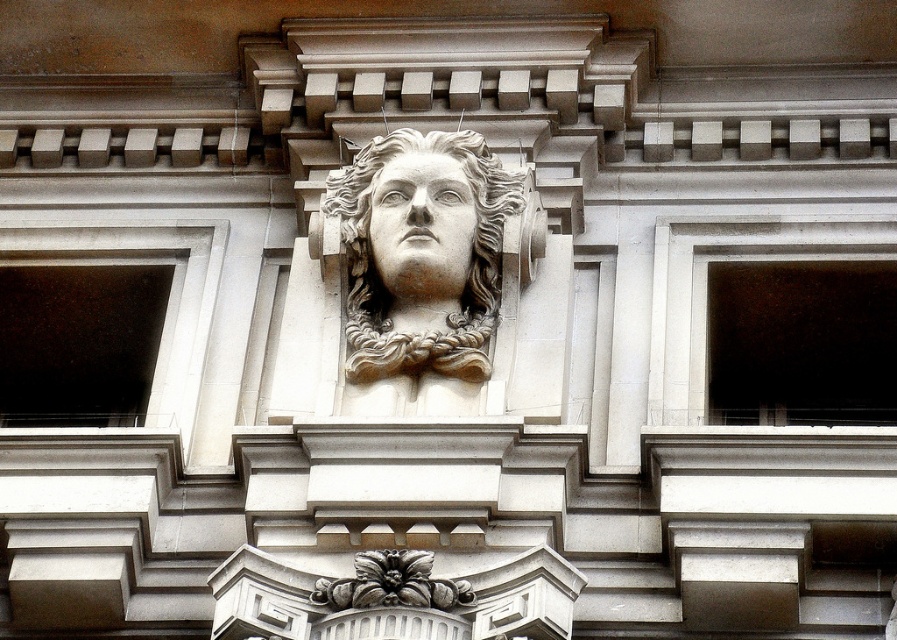
Can you confirm if transparent glass window at left is positioned above dark glass window at right?

No, transparent glass window at left is not above dark glass window at right.

Who is more distant from viewer, (145, 364) or (721, 257)?

Positioned behind is point (145, 364).

This screenshot has height=640, width=897. What are the coordinates of `transparent glass window at left` in the screenshot? It's located at (77, 342).

Between stone sculpture at center and transparent glass window at left, which one appears on the right side from the viewer's perspective?

stone sculpture at center

Can you confirm if stone sculpture at center is smaller than transparent glass window at left?

Indeed, stone sculpture at center has a smaller size compared to transparent glass window at left.

In the scene shown: Who is more distant from viewer, (475, 364) or (59, 358)?

Positioned behind is point (59, 358).

Locate an element on the screen. The image size is (897, 640). stone sculpture at center is located at coordinates (423, 260).

Is stone sculpture at center further to the viewer compared to dark glass window at right?

Yes, stone sculpture at center is behind dark glass window at right.

Locate an element on the screen. This screenshot has width=897, height=640. stone sculpture at center is located at coordinates (423, 260).

Locate an element on the screen. stone sculpture at center is located at coordinates (423, 260).